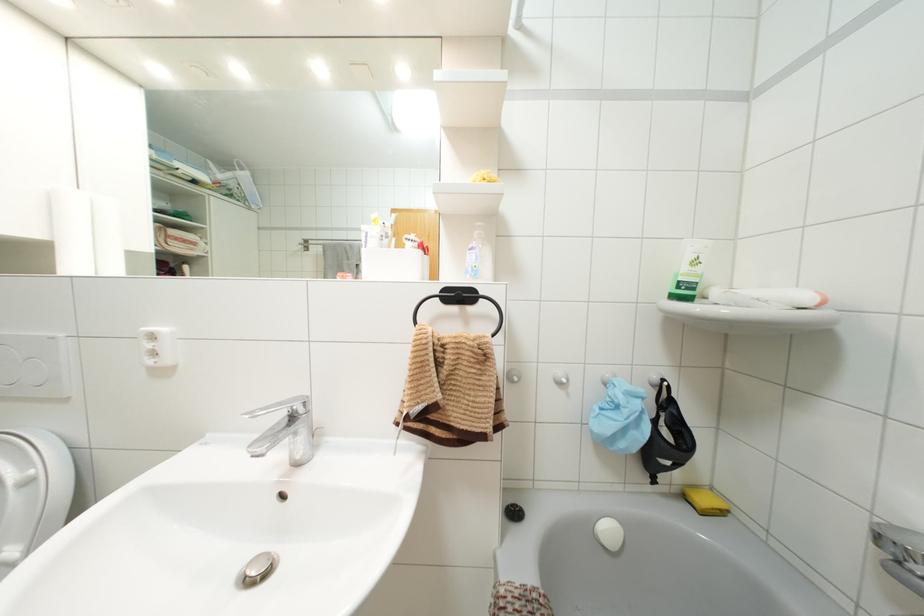
Locate an element on the screen. This screenshot has height=616, width=924. metal sink stopper is located at coordinates (258, 569).